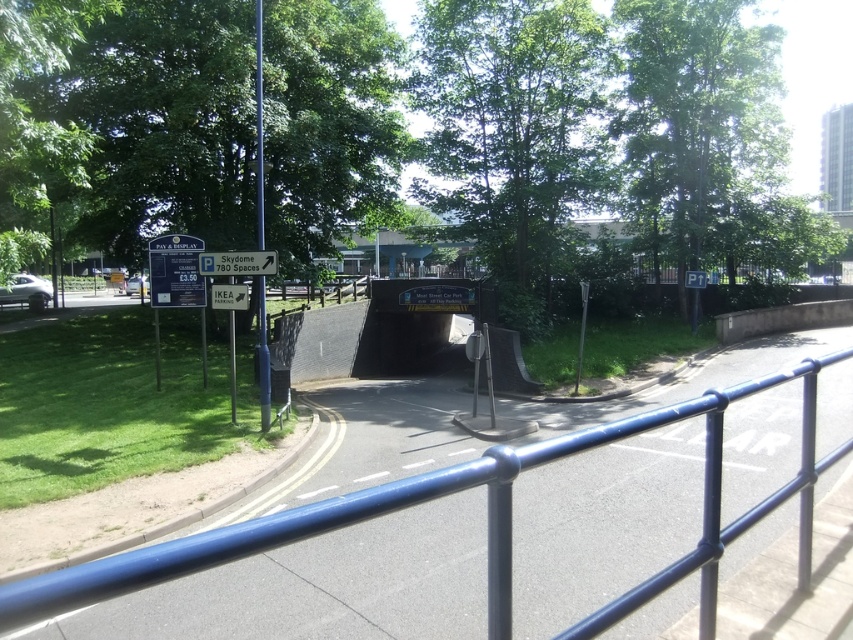
Is point (38, 24) more distant than point (15, 298)?

No.

Does point (68, 141) come closer to viewer compared to point (3, 294)?

Yes, point (68, 141) is closer to viewer.

At what (x,y) coordinates should I click in order to perform the action: click on green leafy tree at upper left. Please return your answer as a coordinate pair (x, y). This screenshot has height=640, width=853. Looking at the image, I should click on [x=38, y=122].

Where is `green leafy tree at upper left`? green leafy tree at upper left is located at coordinates (38, 122).

Does green leafy tree at upper right have a greater height compared to blue plastic sign at upper left?

Correct, green leafy tree at upper right is much taller as blue plastic sign at upper left.

Between green leafy tree at upper right and blue plastic sign at upper left, which one is positioned higher?

green leafy tree at upper right is above.

Does point (705, 182) lie in front of point (181, 296)?

No, it is behind (181, 296).

At what (x,y) coordinates should I click in order to perform the action: click on green leafy tree at upper right. Please return your answer as a coordinate pair (x, y). Image resolution: width=853 pixels, height=640 pixels. Looking at the image, I should click on (695, 122).

Does green leafy tree at center have a lesser height compared to white plastic sign at upper left?

No.

Is green leafy tree at center taller than white plastic sign at upper left?

Yes.

At what (x,y) coordinates should I click in order to perform the action: click on green leafy tree at center. Please return your answer as a coordinate pair (x, y). The image size is (853, 640). Looking at the image, I should click on (514, 131).

Find the location of a particular element. This screenshot has height=640, width=853. green leafy tree at center is located at coordinates 514,131.